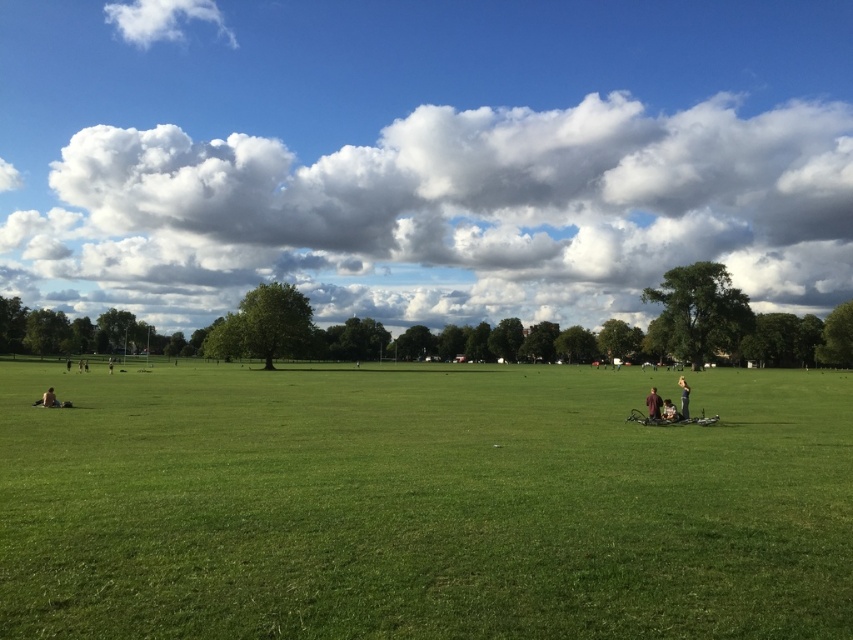
You are standing in the grassy field and see the cloudy sky at upper center and the dark gray fabric person at lower right. Which object is higher in the image?

The cloudy sky at upper center is higher than the dark gray fabric person at lower right because it is positioned above them.